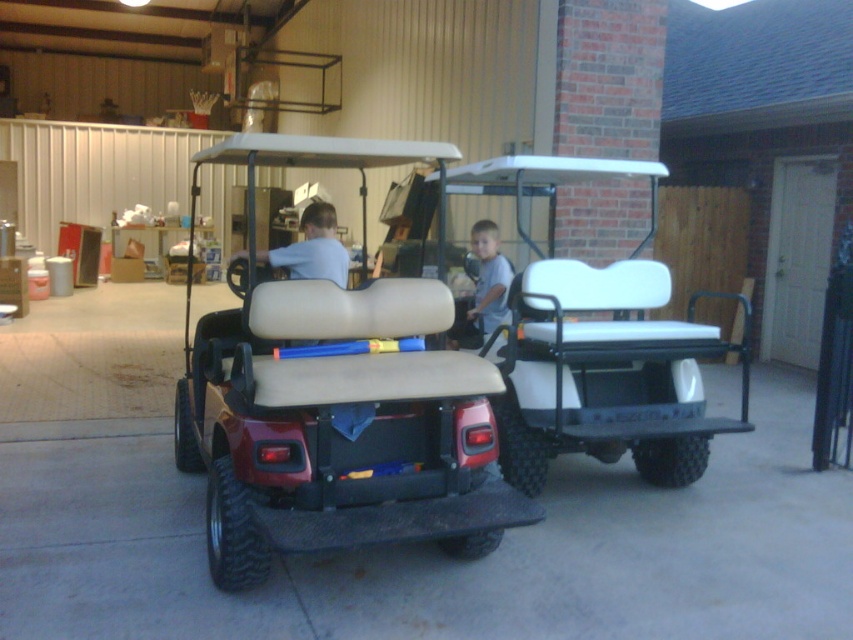
You are standing at the entrance of the garage and want to park your new golf cart exactly where the white matte golf cart at center is currently parked. What are the coordinates you should aim for?

You should aim for the coordinates point (596, 346) where the white matte golf cart at center is currently parked.

You are a delivery robot that is 1.2 meters wide. You need to pass through a narrow doorway that is exactly 1.5 meters wide. There is a white matte golf cart at center and a matte white shirt at center in the scene. Can you fit through the doorway without touching either object?

The white matte golf cart at center might be wider than matte white shirt at center, but since the doorway is 1.5 meters wide and the robot is 1.2 meters wide, there is enough space for the robot to pass through as long as it stays centered and avoids the objects.

You are standing in the garage and want to reach the gray matte shirt at center without moving the beige leather golf cart at center. Is this possible?

The beige leather golf cart at center is below the gray matte shirt at center, so the shirt is positioned higher up, possibly on a shelf or hook. Since the cart is below it, you can reach the shirt without moving the cart by simply extending your arm upwards towards the shirt.